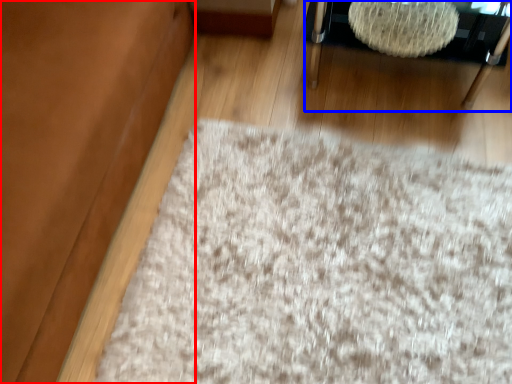
Question: Among these objects, which one is farthest to the camera, couch (highlighted by a red box) or furniture (highlighted by a blue box)?

Choices:
 (A) couch
 (B) furniture

Answer: (B)